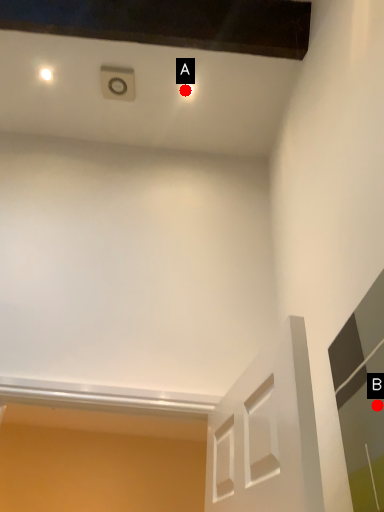
Question: Two points are circled on the image, labeled by A and B beside each circle. Which point is closer to the camera taking this photo?

Choices:
 (A) A is closer
 (B) B is closer

Answer: (B)